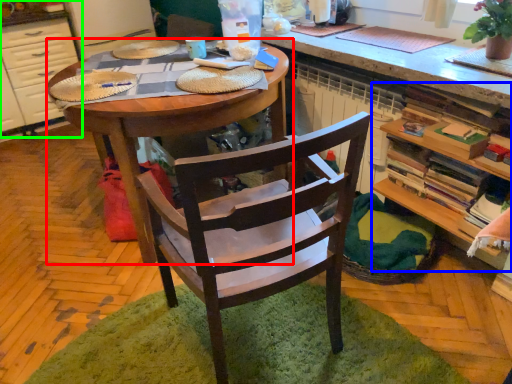
Question: Based on their relative distances, which object is nearer to desk (highlighted by a red box)? Choose from shelf (highlighted by a blue box) and cabinetry (highlighted by a green box).

Choices:
 (A) shelf
 (B) cabinetry

Answer: (A)